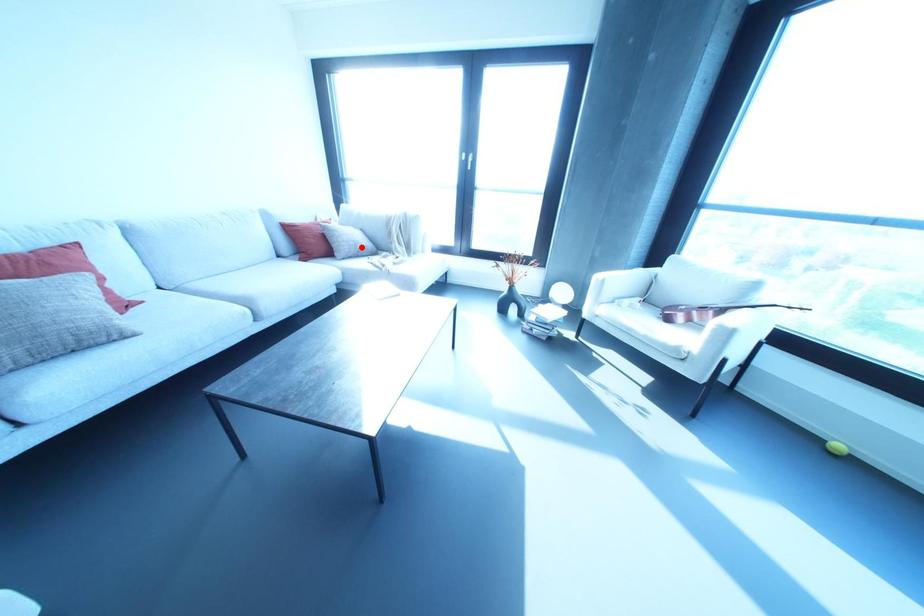
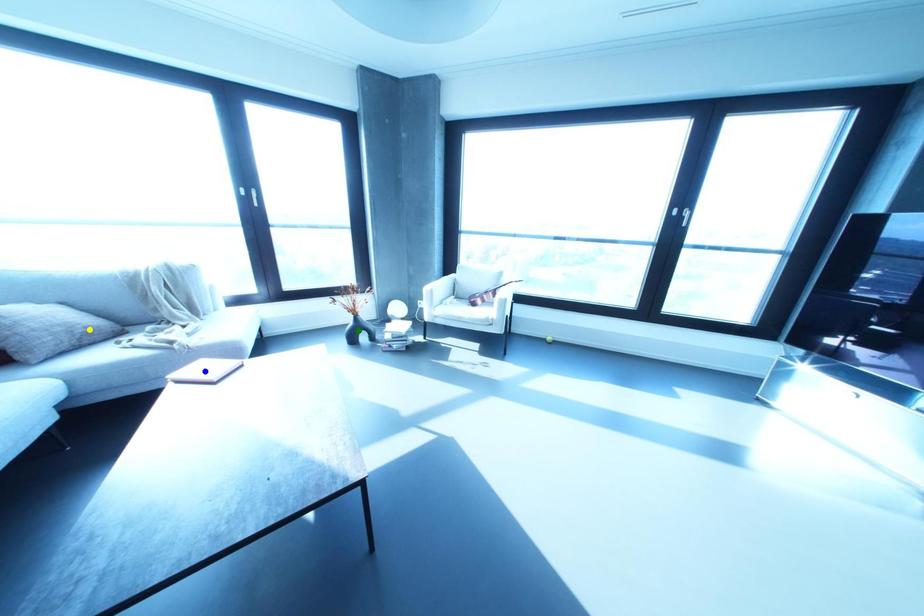
Question: I am providing you with two images of the same scene from different viewpoints. A red point is marked on the first image. You are given multiple points on the second image. Which mark in image 2 goes with the point in image 1?

Choices:
 (A) blue point
 (B) yellow point
 (C) green point

Answer: (B)